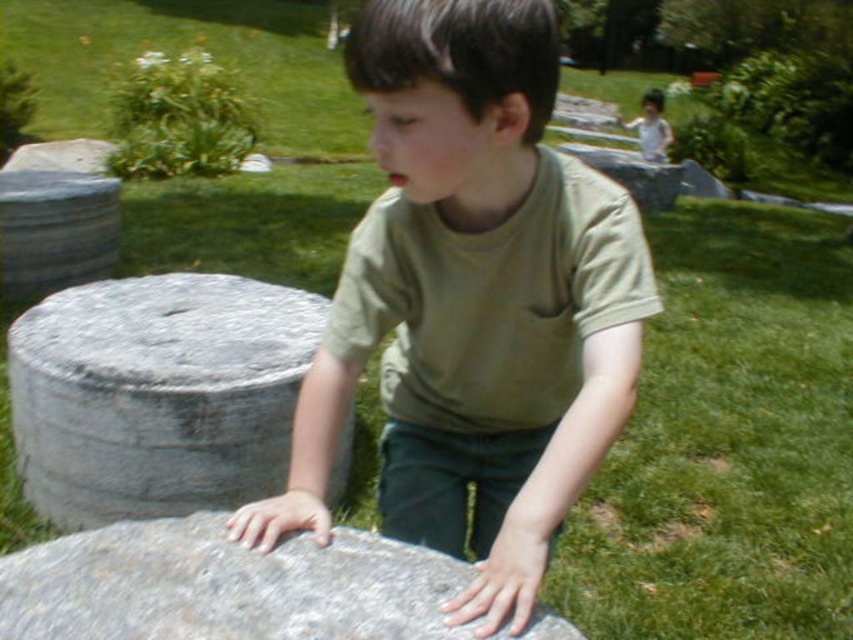
Does gray rough stone at left appear on the left side of gray rough stone at lower left?

Indeed, gray rough stone at left is positioned on the left side of gray rough stone at lower left.

The image size is (853, 640). Find the location of `gray rough stone at left`. gray rough stone at left is located at coordinates (157, 394).

Is green matte shirt at center further to the viewer compared to white matte shirt at upper center?

No, it is in front of white matte shirt at upper center.

Is green matte shirt at center to the left of white matte shirt at upper center from the viewer's perspective?

Yes, green matte shirt at center is to the left of white matte shirt at upper center.

Does point (376, 128) come in front of point (651, 109)?

That is True.

Where is `green matte shirt at center`? The width and height of the screenshot is (853, 640). green matte shirt at center is located at coordinates (473, 301).

Is gray rough stone at lower left positioned at the back of white matte shirt at upper center?

No, gray rough stone at lower left is in front of white matte shirt at upper center.

Measure the distance between gray rough stone at lower left and white matte shirt at upper center.

gray rough stone at lower left and white matte shirt at upper center are 38.19 feet apart from each other.

You are a GUI agent. You are given a task and a screenshot of the screen. Output one action in this format:
    pyautogui.click(x=<x>, y=<y>)
    Task: Click on the gray rough stone at lower left
    The width and height of the screenshot is (853, 640).
    Given the screenshot: What is the action you would take?
    pyautogui.click(x=224, y=586)